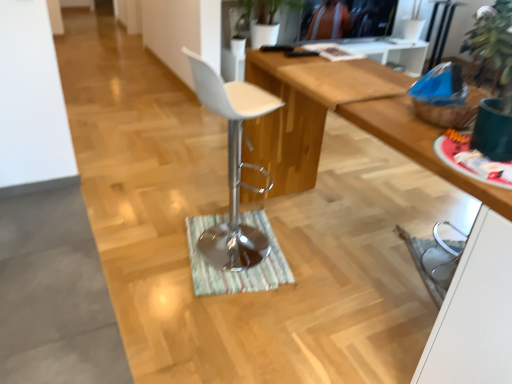
Locate an element on the screen. vacant area on the back side of wooden desk at center is located at coordinates (371, 184).